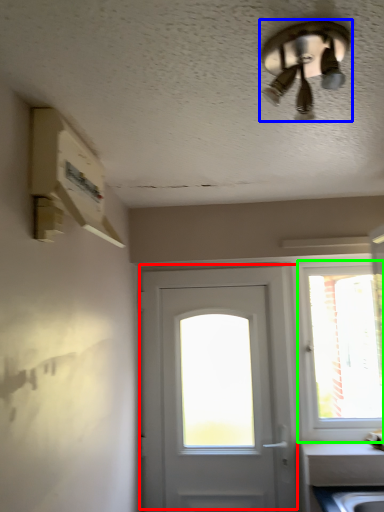
Question: Based on their relative distances, which object is nearer to door (highlighted by a red box)? Choose from ceiling fan (highlighted by a blue box) and window (highlighted by a green box).

Choices:
 (A) ceiling fan
 (B) window

Answer: (A)